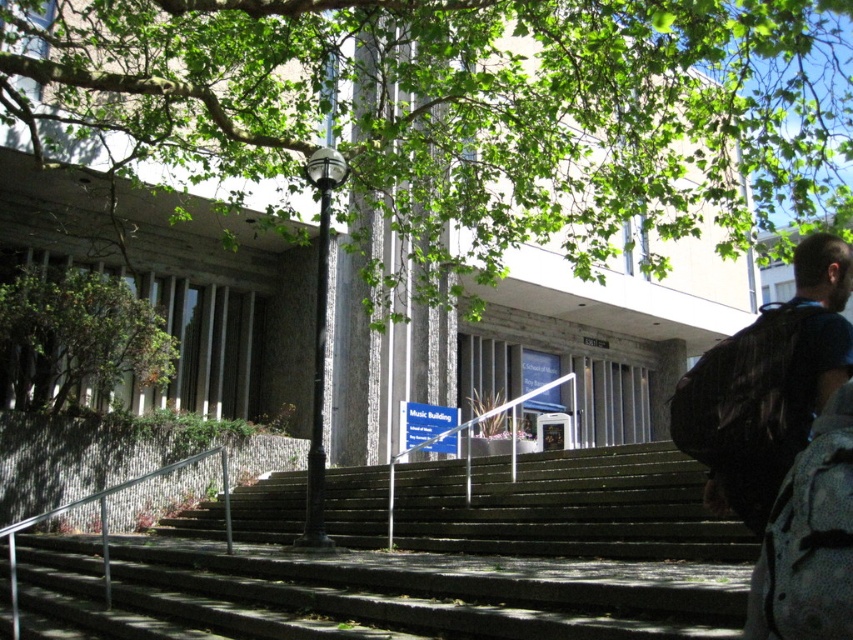
Question: Which point is farther from the camera taking this photo?

Choices:
 (A) (815, 275)
 (B) (254, 570)

Answer: (B)

Question: In this image, where is green leafy tree at upper center located relative to matte black backpack at right?

Choices:
 (A) below
 (B) above

Answer: (B)

Question: From the image, what is the correct spatial relationship of green wooden stairs at center in relation to matte black backpack at right?

Choices:
 (A) above
 (B) below

Answer: (B)

Question: Which object appears closest to the camera in this image?

Choices:
 (A) dark blue backpack at right
 (B) green leafy tree at upper center
 (C) green wooden stairs at center
 (D) green leafy tree at left

Answer: (A)

Question: Can you confirm if green concrete stairs at center is positioned to the left of green wooden stairs at center?

Choices:
 (A) yes
 (B) no

Answer: (A)

Question: Among these points, which one is nearest to the camera?

Choices:
 (A) (19, 328)
 (B) (190, 531)

Answer: (A)